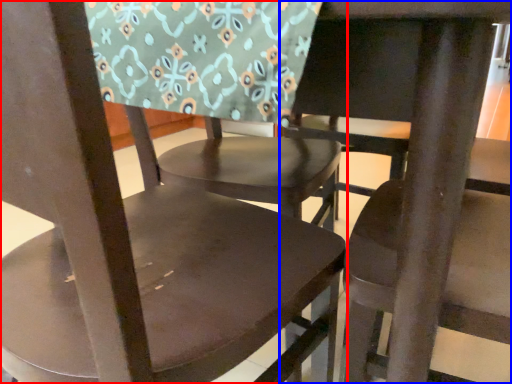
Question: Among these objects, which one is nearest to the camera, chair (highlighted by a red box) or chair (highlighted by a blue box)?

Choices:
 (A) chair
 (B) chair

Answer: (A)